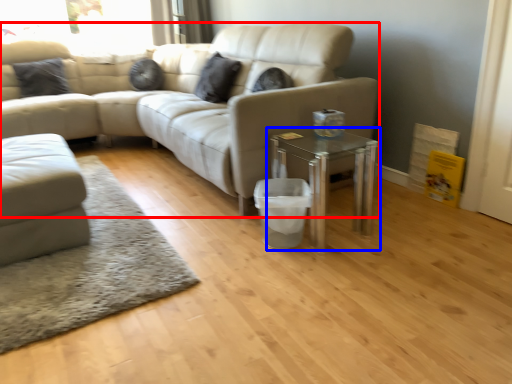
Question: Among these objects, which one is nearest to the camera, studio couch (highlighted by a red box) or table (highlighted by a blue box)?

Choices:
 (A) studio couch
 (B) table

Answer: (B)